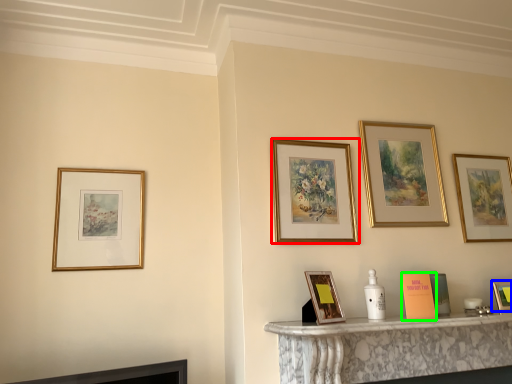
Question: Considering the real-world distances, which object is farthest from picture frame (highlighted by a red box)? picture frame (highlighted by a blue box) or book (highlighted by a green box)?

Choices:
 (A) picture frame
 (B) book

Answer: (A)